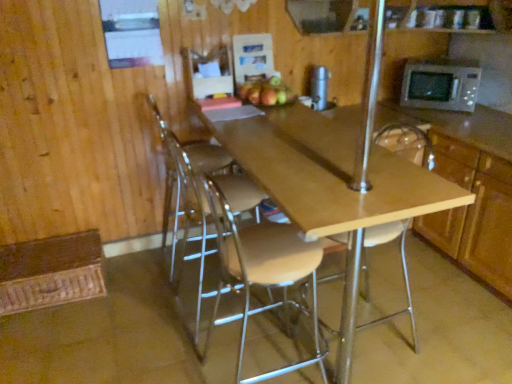
Locate an element on the screen. This screenshot has height=384, width=512. vacant area that lies to the right of wooden seat at center, placed as the 3th chair when sorted from left to right is located at coordinates (439, 337).